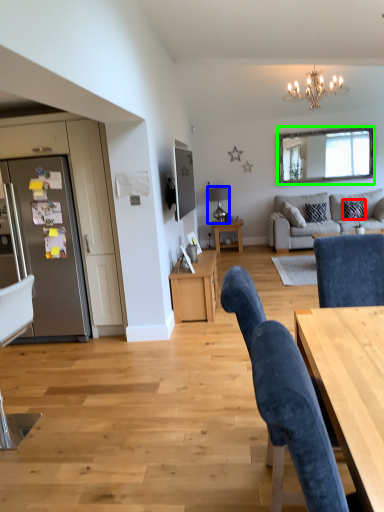
Question: Which object is positioned farthest from pillow (highlighted by a red box)? Select from lamp (highlighted by a blue box) and mirror (highlighted by a green box).

Choices:
 (A) lamp
 (B) mirror

Answer: (A)